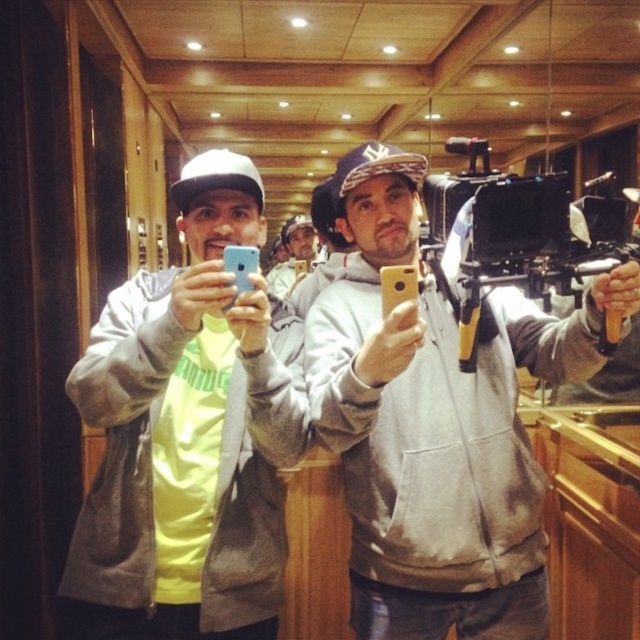
Looking at this image, you are a photographer trying to capture a clear shot of the gray matte hoodie at center and the matte yellow phone at center. Based on their positions in the image, which object is closer to the camera?

The gray matte hoodie at center is closer to the camera because it is in front of the matte yellow phone at center.

You are standing in the room where the image was taken. You want to know how far the point at coordinates (483, 516) is from the camera. Can you determine the distance?

The point at coordinates (483, 516) is 4.14 feet from the camera.